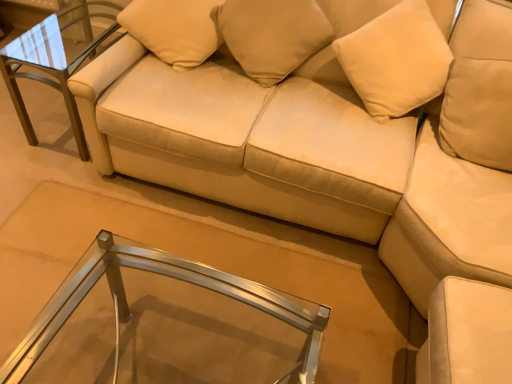
Question: From their relative heights in the image, would you say metal/glass side table at upper left, which ranks as the 2th table in front-to-back order, is taller or shorter than clear glass table at center, which is counted as the 2th table, starting from the back?

Choices:
 (A) tall
 (B) short

Answer: (B)

Question: Is metal/glass side table at upper left, placed as the 2th table when sorted from right to left, wider or thinner than clear glass table at center, placed as the 1th table when sorted from bottom to top?

Choices:
 (A) thin
 (B) wide

Answer: (B)

Question: Which object is positioned farthest from the metal/glass side table at upper left, placed as the 2th table when sorted from right to left?

Choices:
 (A) clear glass table at center, which is counted as the 2th table, starting from the back
 (B) beige fabric pillow at upper center, which appears as the 2th pillow when viewed from the right
 (C) beige fabric pillow at upper center, the first pillow positioned from the right

Answer: (A)

Question: Which of these objects is positioned closest to the beige fabric pillow at upper center, the 2th pillow viewed from the left?

Choices:
 (A) metal/glass side table at upper left, which is counted as the first table, starting from the top
 (B) beige fabric pillow at upper center, which appears as the first pillow when viewed from the left
 (C) clear glass table at center, placed as the 1th table when sorted from bottom to top

Answer: (B)